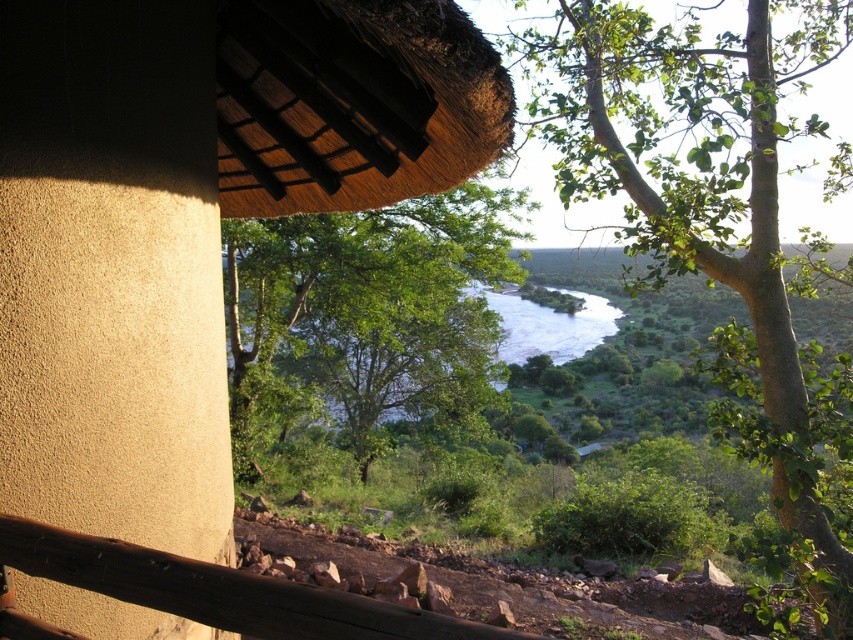
Question: Does thatched roof hut at upper center have a smaller size compared to green leafy tree at upper right?

Choices:
 (A) yes
 (B) no

Answer: (A)

Question: Which of the following is the farthest from the observer?

Choices:
 (A) (483, 106)
 (B) (660, 269)
 (C) (24, 524)
 (D) (265, 317)

Answer: (D)

Question: Among these objects, which one is nearest to the camera?

Choices:
 (A) brown wooden rail at lower center
 (B) green leafy tree at center
 (C) green leafy tree at upper right
 (D) thatched roof hut at upper center

Answer: (A)

Question: Is thatched roof hut at upper center smaller than brown wooden rail at lower center?

Choices:
 (A) no
 (B) yes

Answer: (A)

Question: Can you confirm if thatched roof hut at upper center is positioned above green leafy tree at upper right?

Choices:
 (A) no
 (B) yes

Answer: (A)

Question: Which point appears closest to the camera in this image?

Choices:
 (A) (183, 605)
 (B) (15, 289)

Answer: (A)